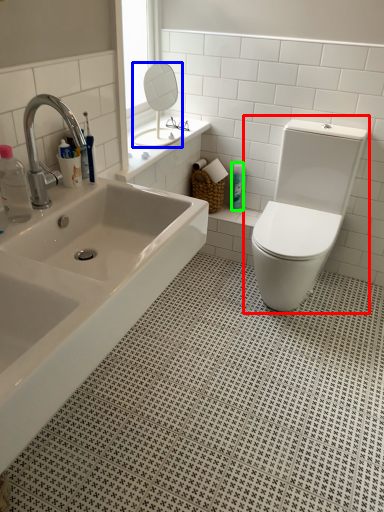
Question: Based on their relative distances, which object is nearer to toilet (highlighted by a red box)? Choose from mirror (highlighted by a blue box) and toiletry (highlighted by a green box).

Choices:
 (A) mirror
 (B) toiletry

Answer: (B)